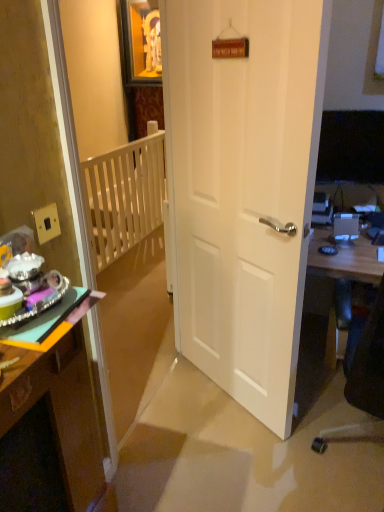
Find the location of a particular element. The height and width of the screenshot is (512, 384). free space that is in between white matte door at center and white wooden bunk bed at upper left is located at coordinates (195, 419).